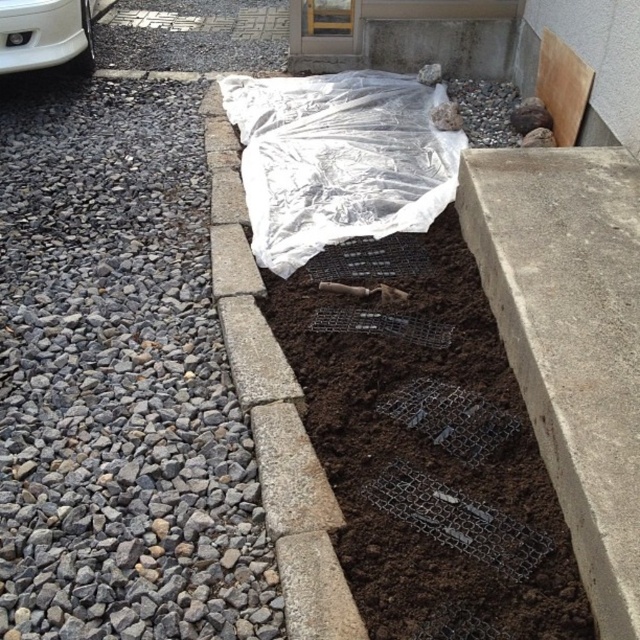
You are a construction worker who needs to access the transparent plastic at center. However, there is a white glossy bumper at upper left in the way. Can you lift the bumper to reach the plastic?

The transparent plastic at center is positioned under the white glossy bumper at upper left, so you can lift the bumper to access the plastic.

You are a gardener who needs to place a new plant in the center of the construction area. The plant requires direct sunlight and cannot be placed under any covering. Given the transparent plastic at center and the gray concrete curb at center, which object must you avoid placing the plant under?

You must avoid placing the plant under the transparent plastic at center because it is positioned on the right side of the gray concrete curb at center, meaning it covers part of the center area where the plant would need direct sunlight.

You are a gardener who wants to cover the soil with a protective layer. You have a transparent plastic at center and a white glossy bumper at upper left. Which one can cover a bigger area of the soil?

The transparent plastic at center has a larger size compared to the white glossy bumper at upper left, so it can cover a bigger area of the soil.